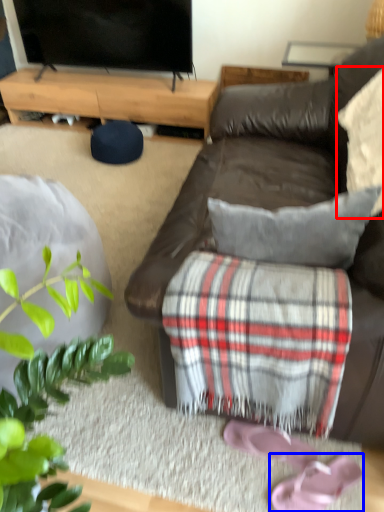
Question: Which object is further to the camera taking this photo, pillow (highlighted by a red box) or footwear (highlighted by a blue box)?

Choices:
 (A) pillow
 (B) footwear

Answer: (B)